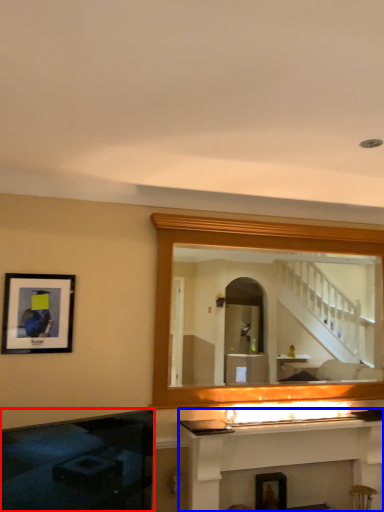
Question: Which object is further to the camera taking this photo, fireplace (highlighted by a red box) or fireplace (highlighted by a blue box)?

Choices:
 (A) fireplace
 (B) fireplace

Answer: (B)